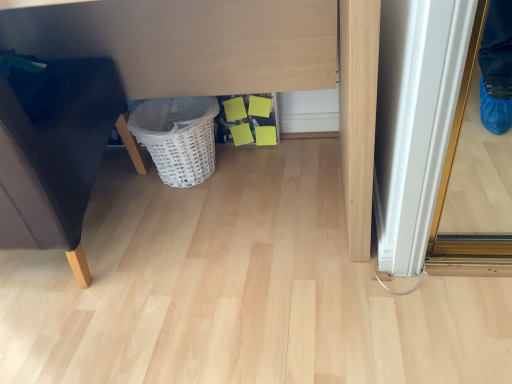
Image resolution: width=512 pixels, height=384 pixels. What are the coordinates of `vacant space in front of white wicker basket at lower center` in the screenshot? It's located at (190, 213).